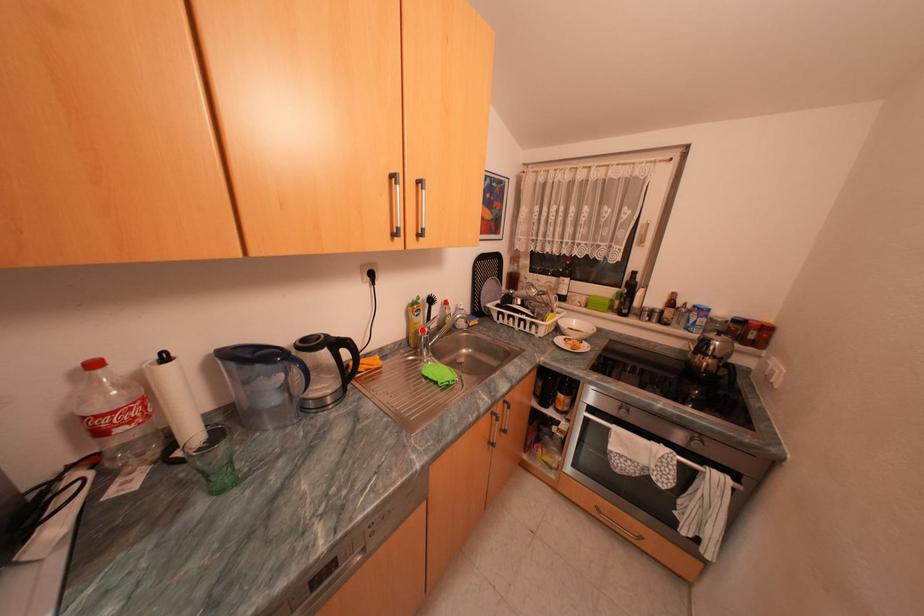
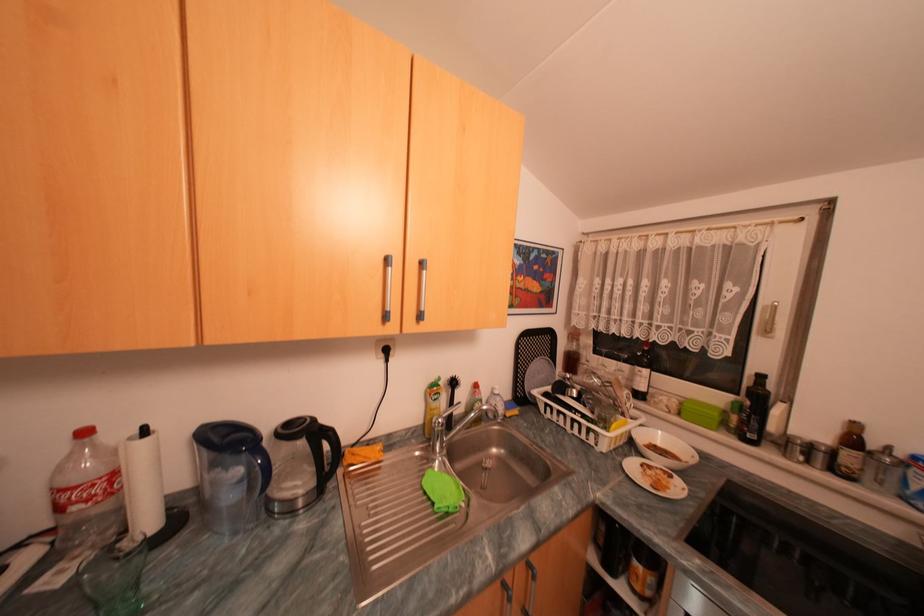
The point at the highlighted location is marked in the first image. Where is the corresponding point in the second image?

(438, 416)